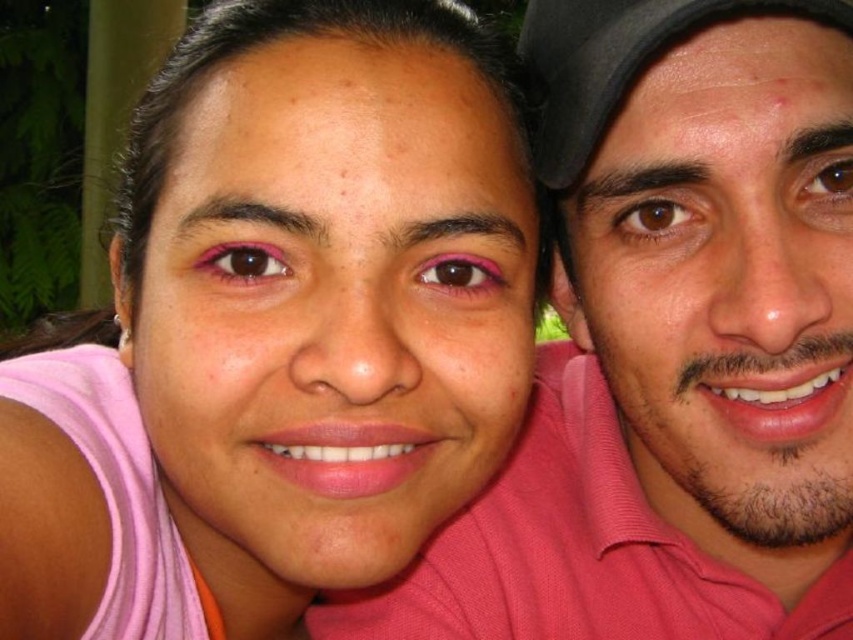
You are a photographer trying to adjust the lighting for a photo shoot. You notice the pink matte skin at center and the pink matte shirt at right in the frame. Which object should you focus the light on to ensure proper exposure since it is taller?

The pink matte skin at center has a greater height compared to the pink matte shirt at right, so you should focus the light on the pink matte skin at center to ensure proper exposure.

Based on the photo, you are a photographer adjusting the lighting for a portrait. You notice the pink matte skin at center and the pink cotton polo shirt at center in the frame. Which of these two objects would require more focused lighting adjustments to ensure proper exposure?

The pink matte skin at center has a larger size compared to the pink cotton polo shirt at center, so it would require more focused lighting adjustments to ensure proper exposure.

You are a photographer trying to capture a closeup shot of the pink cotton polo shirt at center and the black fabric baseball cap at upper right. Which object should you focus on first if you want to ensure both are in focus?

The pink cotton polo shirt at center is located below the black fabric baseball cap at upper right, so you should focus on the black fabric baseball cap at upper right first to ensure both are in focus since it is closer to the camera.